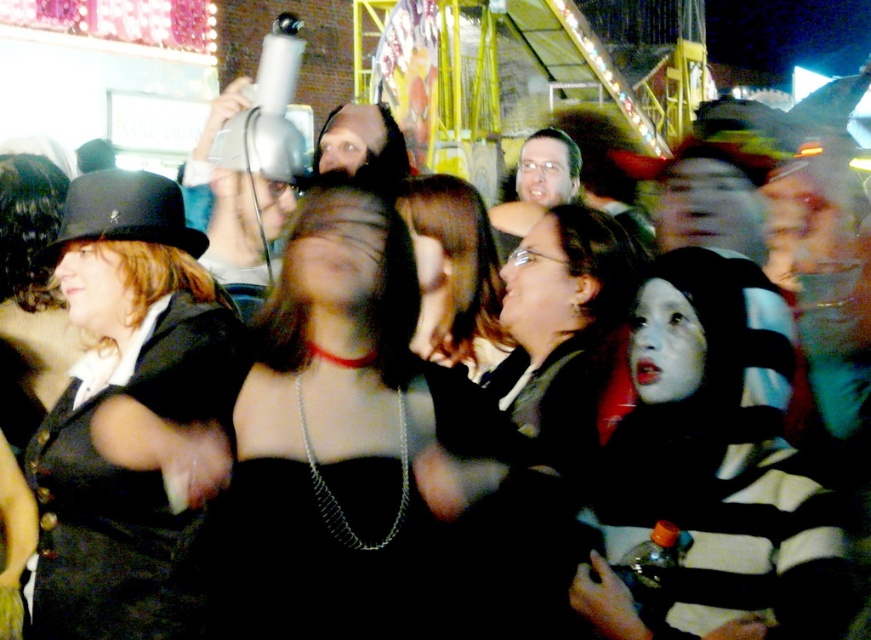
Can you confirm if striped fabric scarf at lower right is shorter than matte black hat at left?

Yes.

Which is below, striped fabric scarf at lower right or matte black hat at left?

striped fabric scarf at lower right

Where is `striped fabric scarf at lower right`? This screenshot has width=871, height=640. striped fabric scarf at lower right is located at coordinates [x=716, y=470].

Is point (348, 192) more distant than point (154, 326)?

Yes, it is.

Is black matte dress at center wider than matte black hat at left?

Yes.

Does point (298, 381) come closer to viewer compared to point (68, 536)?

No, (298, 381) is further to viewer.

The image size is (871, 640). I want to click on black matte dress at center, so click(346, 448).

This screenshot has height=640, width=871. Describe the element at coordinates (119, 394) in the screenshot. I see `matte black hat at left` at that location.

Does matte black hat at left have a lesser width compared to matte black dress at center?

In fact, matte black hat at left might be wider than matte black dress at center.

Between point (142, 260) and point (498, 356), which one is positioned behind?

Point (498, 356)

The image size is (871, 640). Identify the location of matte black hat at left. (119, 394).